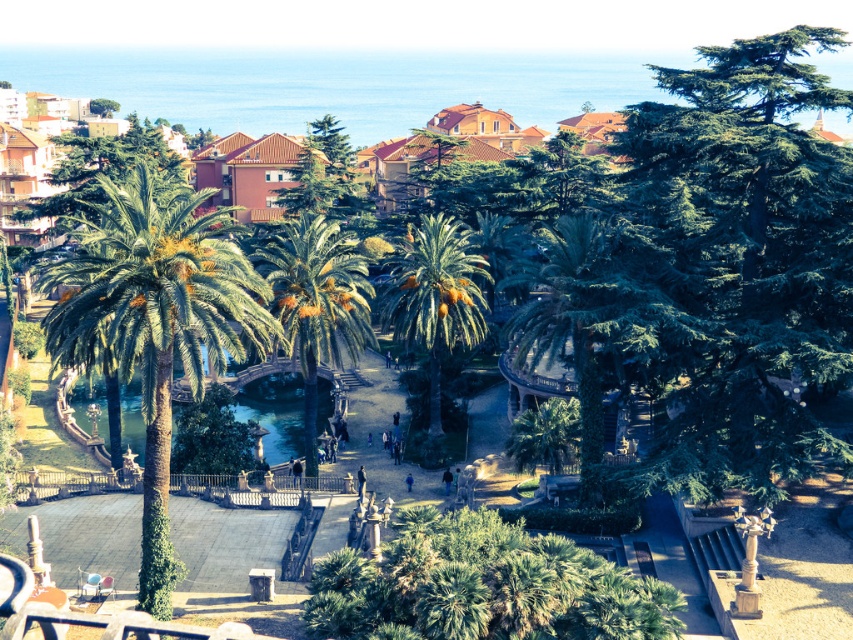
You are planning to place a new bench in the park. The bench requires a space that is wider than the green leafy palm tree at left. Can the green glossy water at center provide enough space for the bench?

The green leafy palm tree at left is larger in size than the green glossy water at center. Since the bench requires a space wider than the palm tree, the green glossy water at center is not large enough to accommodate the bench.

You are a gardener planning to trim the green leafy palm tree at left and the green leafy palm at center. Which palm tree requires more effort to trim due to its size?

The green leafy palm tree at left requires more effort to trim because it is bigger than the green leafy palm at center.

You are a gardener planning to place a new bench along the pathway. Considering the space occupied by the green leafy palm at center and the green glossy water at center, which object requires more horizontal space for placement?

The green glossy water at center requires more horizontal space because it has a greater width than the green leafy palm at center.